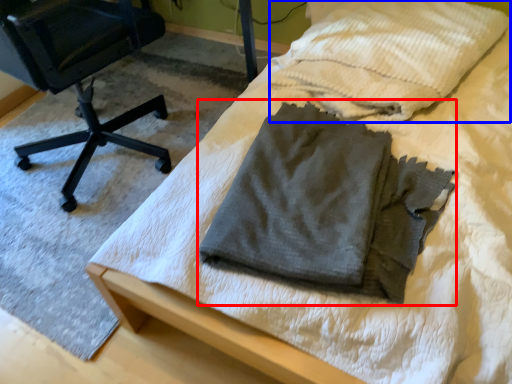
Question: Which object appears closest to the camera in this image, laundry (highlighted by a red box) or cloth (highlighted by a blue box)?

Choices:
 (A) laundry
 (B) cloth

Answer: (A)